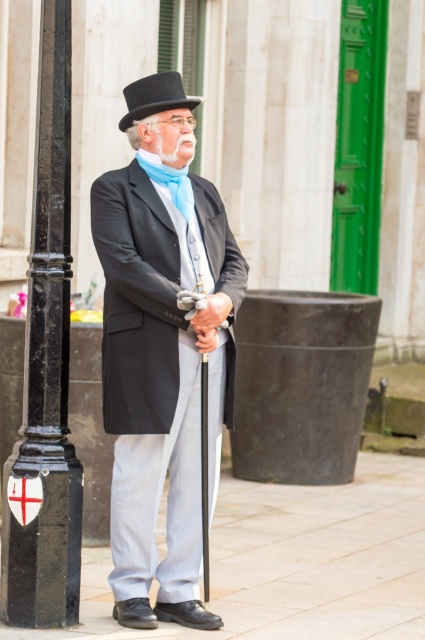
Question: Which object is positioned farthest from the black polished metal pole at left?

Choices:
 (A) black felt top hat at upper center
 (B) matte black coat at center

Answer: (A)

Question: Does light gray stone pavement at lower center appear over black polished metal pole at left?

Choices:
 (A) yes
 (B) no

Answer: (B)

Question: Which point is closer to the camera?

Choices:
 (A) black polished metal pole at left
 (B) light gray stone pavement at lower center
 (C) matte black coat at center
 (D) black felt top hat at upper center

Answer: (B)

Question: Does matte black coat at center have a greater width compared to light gray stone pavement at lower center?

Choices:
 (A) no
 (B) yes

Answer: (A)

Question: Which of these objects is positioned farthest from the black felt top hat at upper center?

Choices:
 (A) black polished metal pole at left
 (B) light gray stone pavement at lower center
 (C) matte black coat at center

Answer: (B)

Question: Is black polished metal pole at left above black felt top hat at upper center?

Choices:
 (A) no
 (B) yes

Answer: (A)